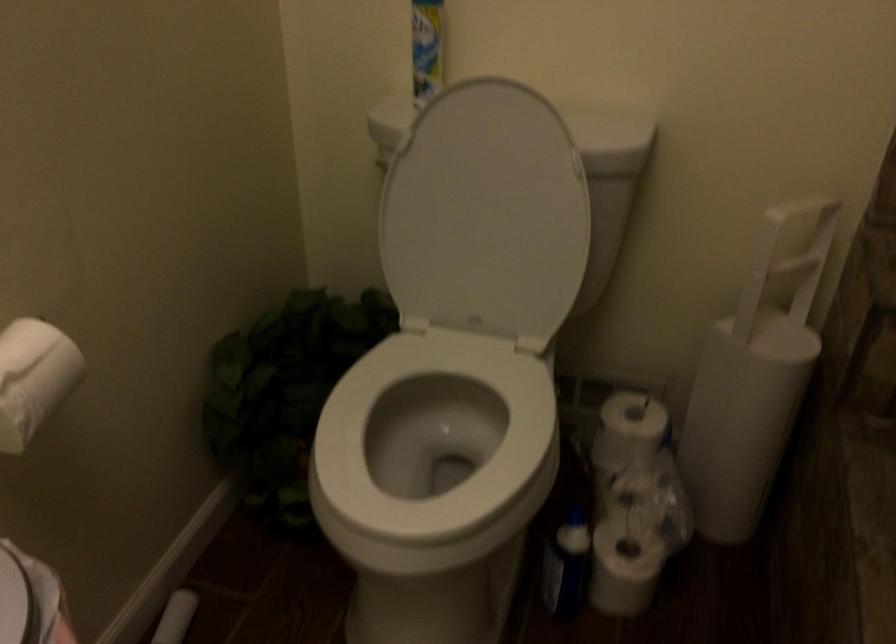
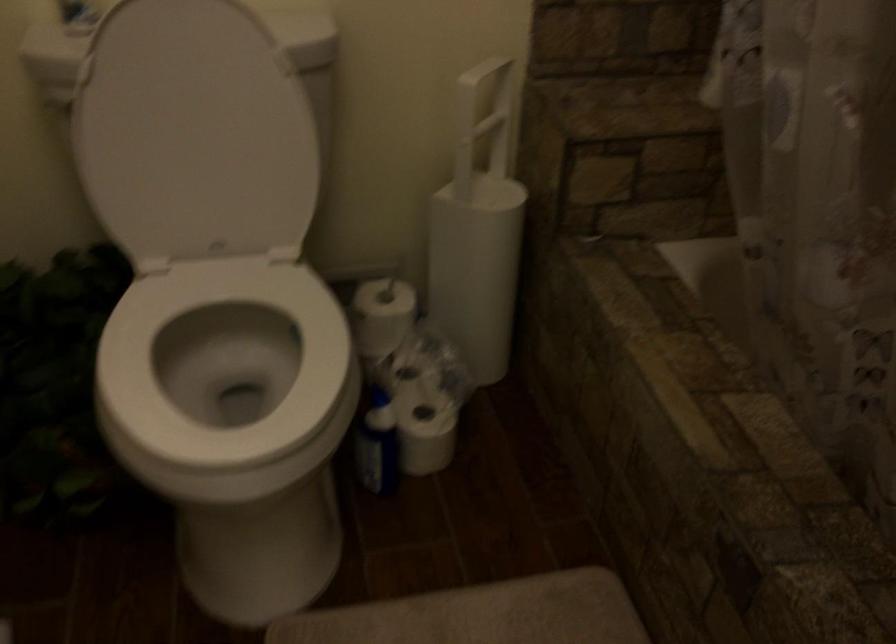
Find the pixel in the second image that matches [561,558] in the first image.

(375, 442)